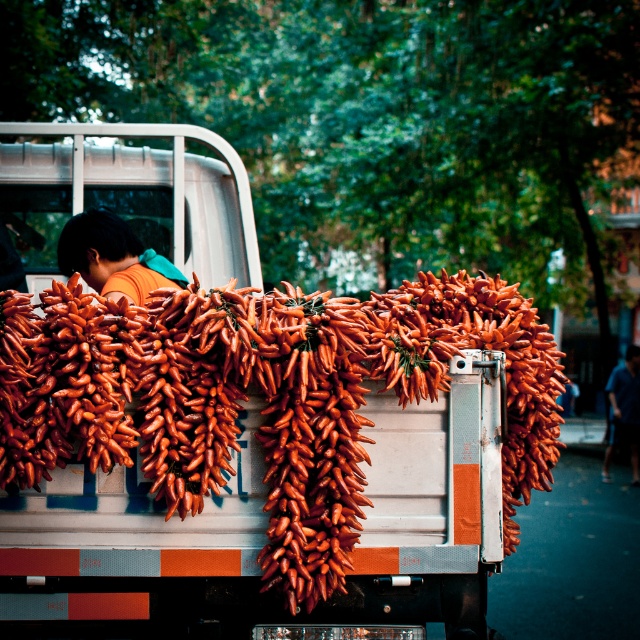
Question: Is matte orange carrots at center to the right of orange matte shirt at center from the viewer's perspective?

Choices:
 (A) no
 (B) yes

Answer: (B)

Question: Is matte orange carrots at center to the left of orange matte shirt at center from the viewer's perspective?

Choices:
 (A) yes
 (B) no

Answer: (B)

Question: Which point is farther to the camera?

Choices:
 (A) blue fabric shirt at right
 (B) orange matte shirt at center
 (C) matte orange carrots at center

Answer: (A)

Question: Does matte orange carrots at center come behind orange matte shirt at center?

Choices:
 (A) yes
 (B) no

Answer: (B)

Question: Which point appears farthest from the camera in this image?

Choices:
 (A) (627, 372)
 (B) (356, 579)
 (C) (148, 282)

Answer: (A)

Question: Which object appears closest to the camera in this image?

Choices:
 (A) matte orange carrots at center
 (B) orange matte shirt at center
 (C) blue fabric shirt at right

Answer: (A)